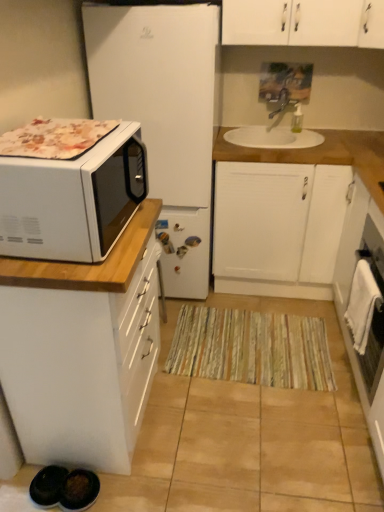
The height and width of the screenshot is (512, 384). I want to click on empty space that is ontop of white glossy microwave at left (from a real-world perspective), so click(79, 136).